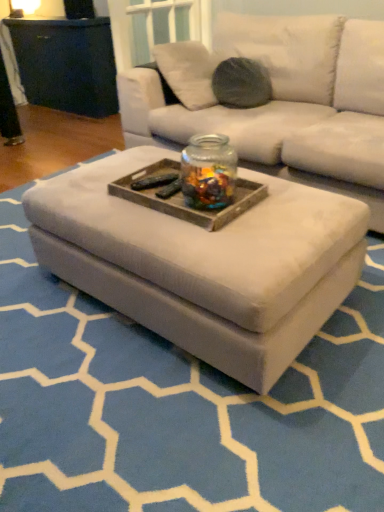
Question: Is wooden tray at center outside white fabric ottoman at center?

Choices:
 (A) no
 (B) yes

Answer: (B)

Question: Is the position of wooden tray at center less distant than that of white fabric ottoman at center?

Choices:
 (A) no
 (B) yes

Answer: (A)

Question: From a real-world perspective, is wooden tray at center located beneath white fabric ottoman at center?

Choices:
 (A) no
 (B) yes

Answer: (A)

Question: Is wooden tray at center placed right next to white fabric ottoman at center?

Choices:
 (A) yes
 (B) no

Answer: (B)

Question: From the image's perspective, is wooden tray at center above white fabric ottoman at center?

Choices:
 (A) no
 (B) yes

Answer: (B)

Question: Does wooden tray at center have a smaller size compared to white fabric ottoman at center?

Choices:
 (A) no
 (B) yes

Answer: (B)

Question: Considering the relative sizes of white fabric ottoman at center and transparent glass jar at center in the image provided, is white fabric ottoman at center thinner than transparent glass jar at center?

Choices:
 (A) no
 (B) yes

Answer: (A)

Question: Considering the relative positions of white fabric ottoman at center and transparent glass jar at center in the image provided, is white fabric ottoman at center in front of transparent glass jar at center?

Choices:
 (A) yes
 (B) no

Answer: (A)

Question: Can you confirm if white fabric ottoman at center is positioned to the left of transparent glass jar at center?

Choices:
 (A) yes
 (B) no

Answer: (A)

Question: Considering the relative sizes of white fabric ottoman at center and transparent glass jar at center in the image provided, is white fabric ottoman at center taller than transparent glass jar at center?

Choices:
 (A) no
 (B) yes

Answer: (A)

Question: Is white fabric ottoman at center beside transparent glass jar at center?

Choices:
 (A) no
 (B) yes

Answer: (A)

Question: From the image's perspective, is white fabric ottoman at center located above transparent glass jar at center?

Choices:
 (A) yes
 (B) no

Answer: (B)

Question: Considering the relative sizes of transparent glass jar at center and white fabric ottoman at center in the image provided, is transparent glass jar at center thinner than white fabric ottoman at center?

Choices:
 (A) no
 (B) yes

Answer: (B)